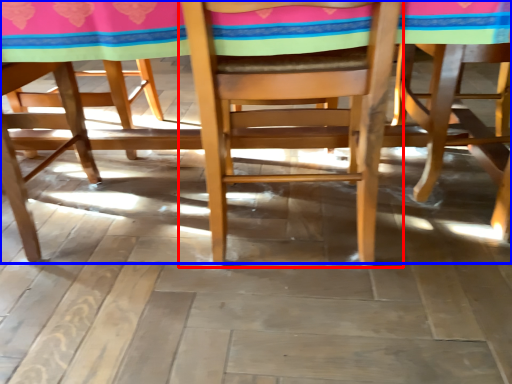
Question: Which object appears closest to the camera in this image, chair (highlighted by a red box) or table (highlighted by a blue box)?

Choices:
 (A) chair
 (B) table

Answer: (A)